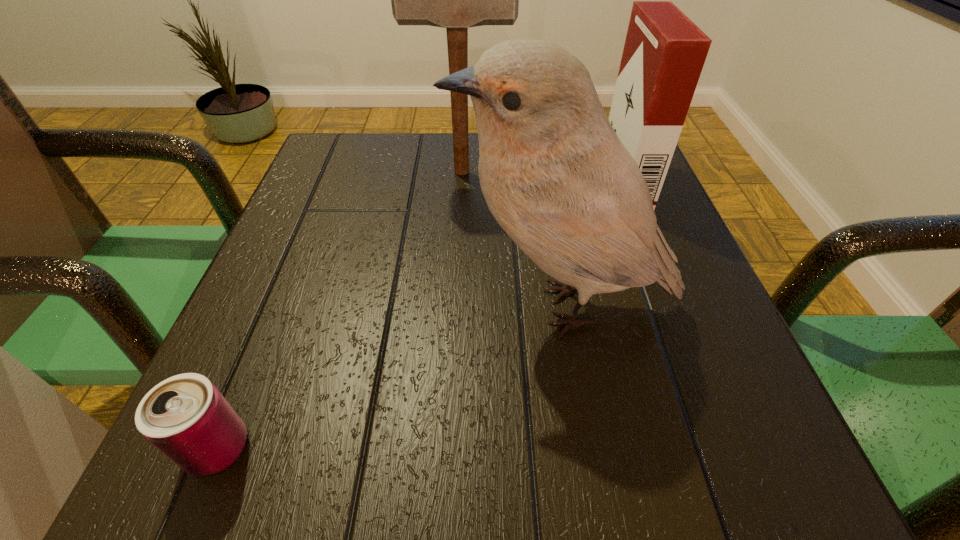
Identify the location of mallet. (456, 0).

Image resolution: width=960 pixels, height=540 pixels. Identify the location of the second nearest object. (554, 174).

Find the location of a particular element. cigarette_case is located at coordinates (664, 53).

Where is `the leftmost object`? This screenshot has width=960, height=540. the leftmost object is located at coordinates (186, 417).

The image size is (960, 540). What are the coordinates of `can` in the screenshot? It's located at (186, 417).

Where is `vacant space positioned on the striking face of the mallet`? vacant space positioned on the striking face of the mallet is located at coordinates (620, 172).

What are the coordinates of `vacant area located on the face of the parakeet` in the screenshot? It's located at (379, 307).

The image size is (960, 540). I want to click on vacant space located 0.080m on the face of the parakeet, so click(398, 307).

This screenshot has width=960, height=540. Identify the location of free space located on the front-facing side of the second shortest object. pyautogui.click(x=476, y=181).

The height and width of the screenshot is (540, 960). I want to click on vacant space located 0.290m on the front-facing side of the second shortest object, so click(x=471, y=181).